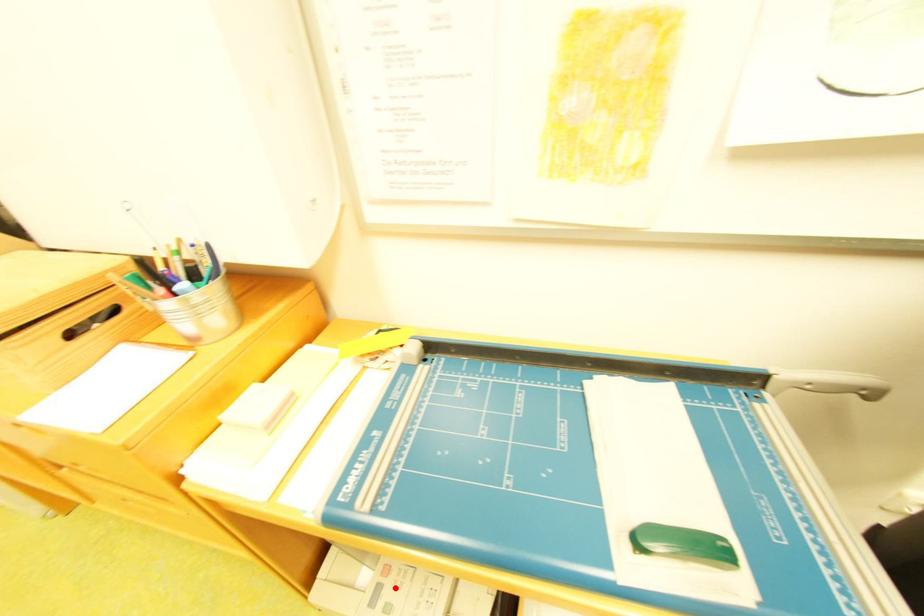
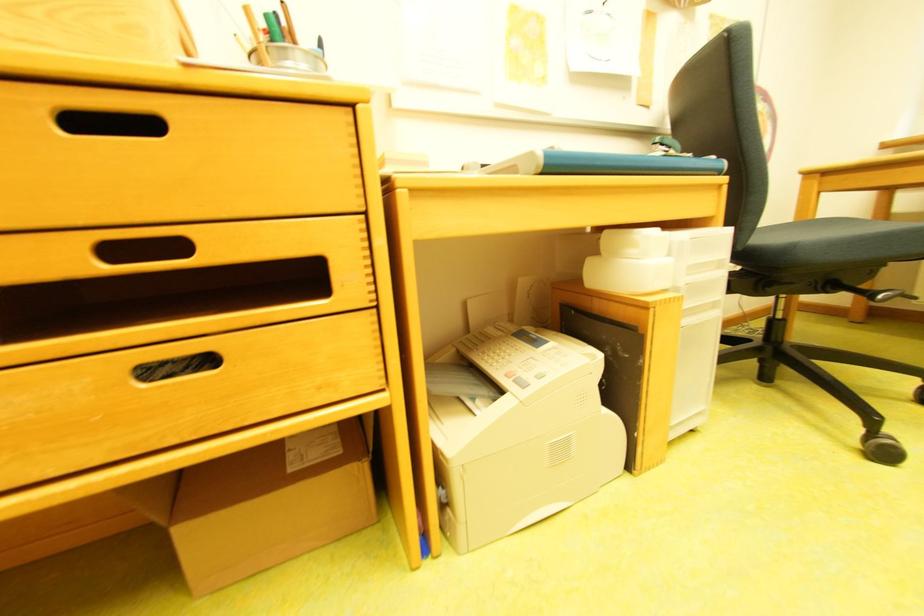
Find the pixel in the second image that matches the highlighted location in the first image.

(531, 378)